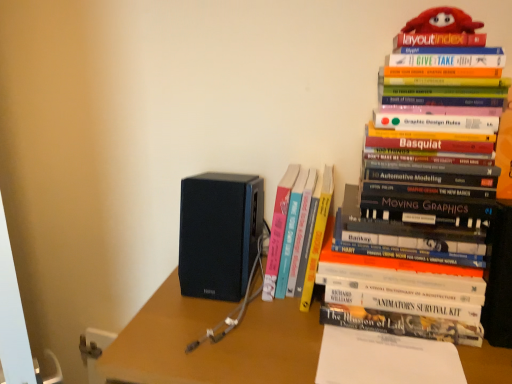
What are the coordinates of `matte black speaker at center` in the screenshot? It's located at (215, 344).

The height and width of the screenshot is (384, 512). What do you see at coordinates (288, 227) in the screenshot? I see `hardcover book at center, which is the second book in right-to-left order` at bounding box center [288, 227].

I want to click on black matte speaker at center, so click(x=219, y=234).

Where is `white paper at center`? This screenshot has height=384, width=512. white paper at center is located at coordinates (385, 359).

Would you say white paper at center is part of hardcover book at center, arranged as the first book when viewed from the left,'s contents?

No, white paper at center is not inside hardcover book at center, arranged as the first book when viewed from the left.

Is point (285, 187) positioned after point (450, 353)?

Yes, point (285, 187) is behind point (450, 353).

Is hardcover book at center, which is the second book in right-to-left order, not close to white paper at center?

No, hardcover book at center, which is the second book in right-to-left order, is in close proximity to white paper at center.

Which object is positioned more to the left, hardcover book at center, arranged as the first book when viewed from the left, or white paper at center?

Positioned to the left is hardcover book at center, arranged as the first book when viewed from the left.

From a real-world perspective, which is physically below, hardcover book at upper right, the 2th book viewed from the left, or white paper at center?

white paper at center.

Considering the relative sizes of hardcover book at upper right, arranged as the first book when viewed from the right, and white paper at center in the image provided, is hardcover book at upper right, arranged as the first book when viewed from the right, bigger than white paper at center?

Indeed, hardcover book at upper right, arranged as the first book when viewed from the right, has a larger size compared to white paper at center.

Is hardcover book at upper right, arranged as the first book when viewed from the right, positioned beyond the bounds of white paper at center?

That's correct, hardcover book at upper right, arranged as the first book when viewed from the right, is outside of white paper at center.

From the image's perspective, which one is positioned higher, hardcover book at upper right, the 2th book viewed from the left, or white paper at center?

hardcover book at upper right, the 2th book viewed from the left.

Considering the relative sizes of hardcover book at center, which is the second book in right-to-left order, and hardcover book at upper right, arranged as the first book when viewed from the right, in the image provided, is hardcover book at center, which is the second book in right-to-left order, wider than hardcover book at upper right, arranged as the first book when viewed from the right,?

No, hardcover book at center, which is the second book in right-to-left order, is not wider than hardcover book at upper right, arranged as the first book when viewed from the right.

Considering the positions of points (298, 247) and (410, 114), is point (298, 247) farther from camera compared to point (410, 114)?

Yes, point (298, 247) is farther from viewer.

What are the coordinates of `book directly beneath the hardcover book at upper right, the 2th book viewed from the left (from a real-world perspective)` in the screenshot? It's located at (288, 227).

From the image's perspective, would you say hardcover book at center, arranged as the first book when viewed from the left, is positioned over hardcover book at upper right, the 2th book viewed from the left?

No, from the image's perspective, hardcover book at center, arranged as the first book when viewed from the left, is not over hardcover book at upper right, the 2th book viewed from the left.

Is matte black speaker at center facing towards black matte speaker at center?

No, matte black speaker at center is not turned towards black matte speaker at center.

Can you confirm if matte black speaker at center is positioned to the left of black matte speaker at center?

No, matte black speaker at center is not to the left of black matte speaker at center.

From their relative heights in the image, would you say matte black speaker at center is taller or shorter than black matte speaker at center?

Clearly, matte black speaker at center is taller compared to black matte speaker at center.

Looking at this image, from the image's perspective, between black matte speaker at center and matte black speaker at center, who is located below?

matte black speaker at center, from the image's perspective.

Is point (230, 269) positioned before point (216, 321)?

No, it is behind (216, 321).

Would you say black matte speaker at center is inside or outside matte black speaker at center?

The correct answer is: outside.

Is black matte speaker at center to the right of white paper at center from the viewer's perspective?

No, black matte speaker at center is not to the right of white paper at center.

From the picture: Is black matte speaker at center not close to white paper at center?

No, black matte speaker at center is not far away from white paper at center.

Consider the image. Would you say black matte speaker at center is outside white paper at center?

Yes, black matte speaker at center is outside of white paper at center.

How different are the orientations of white paper at center and matte black speaker at center in degrees?

The angle between the facing direction of white paper at center and the facing direction of matte black speaker at center is 0.474 degrees.

Considering the sizes of objects white paper at center and matte black speaker at center in the image provided, who is wider, white paper at center or matte black speaker at center?

Wider between the two is matte black speaker at center.

Is the surface of white paper at center in direct contact with matte black speaker at center?

There is a gap between white paper at center and matte black speaker at center.

Which of these two, white paper at center or matte black speaker at center, stands shorter?

With less height is white paper at center.

At what (x,y) coordinates should I click in order to perform the action: click on paperback book that appears below the hardcover book at center, which is the second book in right-to-left order (from the image's perspective). Please return your answer as a coordinate pair (x, y). This screenshot has height=384, width=512. Looking at the image, I should click on (385, 359).

From a real-world perspective, starting from the white paper at center, which book is the 2nd one vertically above it? Please provide its 2D coordinates.

[(437, 180)]

Based on their spatial positions, is black matte speaker at center or hardcover book at center, arranged as the first book when viewed from the left, closer to white paper at center?

hardcover book at center, arranged as the first book when viewed from the left, is closer to white paper at center.

From the image, which object appears to be farther from matte black speaker at center, white paper at center or hardcover book at center, arranged as the first book when viewed from the left?

The object further to matte black speaker at center is hardcover book at center, arranged as the first book when viewed from the left.

From the image, which object appears to be farther from hardcover book at upper right, arranged as the first book when viewed from the right, hardcover book at center, arranged as the first book when viewed from the left, or white paper at center?

white paper at center lies further to hardcover book at upper right, arranged as the first book when viewed from the right, than the other object.

From the image, which object appears to be farther from white paper at center, matte black speaker at center or black matte speaker at center?

black matte speaker at center is positioned further to the anchor white paper at center.

Based on their spatial positions, is black matte speaker at center or hardcover book at upper right, the 2th book viewed from the left, closer to matte black speaker at center?

black matte speaker at center is closer to matte black speaker at center.

When comparing their distances from black matte speaker at center, does matte black speaker at center or hardcover book at upper right, arranged as the first book when viewed from the right, seem further?

hardcover book at upper right, arranged as the first book when viewed from the right, lies further to black matte speaker at center than the other object.

Estimate the real-world distances between objects in this image. Which object is closer to hardcover book at upper right, arranged as the first book when viewed from the right, white paper at center or hardcover book at center, which is the second book in right-to-left order?

hardcover book at center, which is the second book in right-to-left order, is positioned closer to the anchor hardcover book at upper right, arranged as the first book when viewed from the right.

Estimate the real-world distances between objects in this image. Which object is closer to matte black speaker at center, black matte speaker at center or hardcover book at center, arranged as the first book when viewed from the left?

black matte speaker at center.

At what (x,y) coordinates should I click in order to perform the action: click on paperback book that lies between black matte speaker at center and matte black speaker at center from top to bottom. Please return your answer as a coordinate pair (x, y). This screenshot has height=384, width=512. Looking at the image, I should click on (385, 359).

Locate an element on the screen. Image resolution: width=512 pixels, height=384 pixels. book between hardcover book at upper right, the 2th book viewed from the left, and white paper at center from top to bottom is located at coordinates (288, 227).

Where is `book between black matte speaker at center and white paper at center in the horizontal direction`? The width and height of the screenshot is (512, 384). book between black matte speaker at center and white paper at center in the horizontal direction is located at coordinates (288, 227).

Locate an element on the screen. Image resolution: width=512 pixels, height=384 pixels. book between black matte speaker at center and matte black speaker at center vertically is located at coordinates (288, 227).